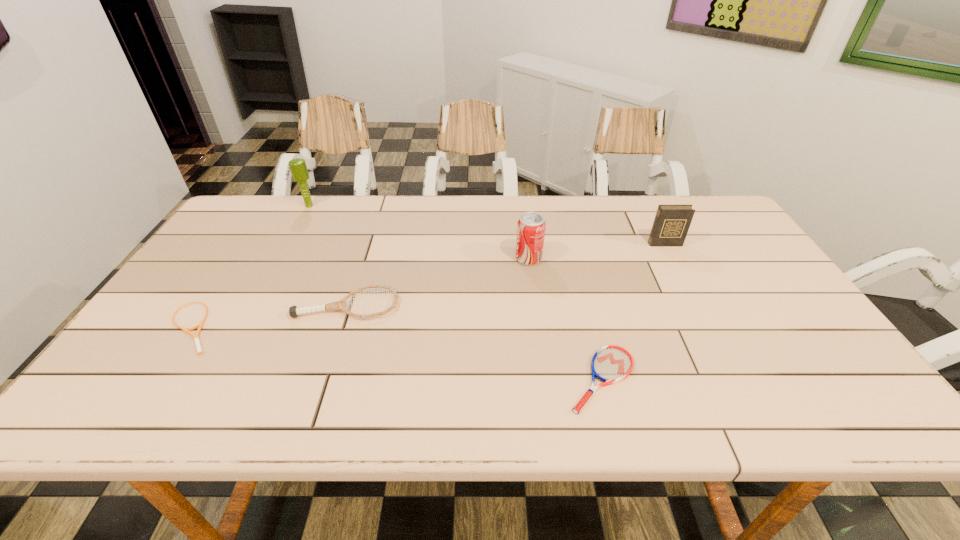
This screenshot has height=540, width=960. I want to click on the leftmost object, so click(196, 337).

In order to click on the shortest object in this screenshot , I will do `click(196, 337)`.

Where is `vacant area situated on the right of the tallest object`? This screenshot has width=960, height=540. vacant area situated on the right of the tallest object is located at coordinates (399, 206).

Locate an element on the screen. vacant position located 0.320m on the left of the fourth object from left to right is located at coordinates (405, 259).

Locate an element on the screen. Image resolution: width=960 pixels, height=540 pixels. vacant space situated on the front cover of the diary is located at coordinates (698, 308).

At what (x,y) coordinates should I click in order to perform the action: click on vacant space located 0.360m on the back of the tallest tennis racket. Please return your answer as a coordinate pair (x, y). Looking at the image, I should click on (376, 215).

The width and height of the screenshot is (960, 540). Find the location of `free space located on the back of the second shortest tennis racket`. free space located on the back of the second shortest tennis racket is located at coordinates (587, 317).

Image resolution: width=960 pixels, height=540 pixels. What are the coordinates of `free space located on the right of the shortest tennis racket` in the screenshot? It's located at (286, 327).

Locate an element on the screen. This screenshot has height=540, width=960. object located in the far edge section of the desktop is located at coordinates (298, 167).

The width and height of the screenshot is (960, 540). Find the location of `object that is at the near edge`. object that is at the near edge is located at coordinates (610, 364).